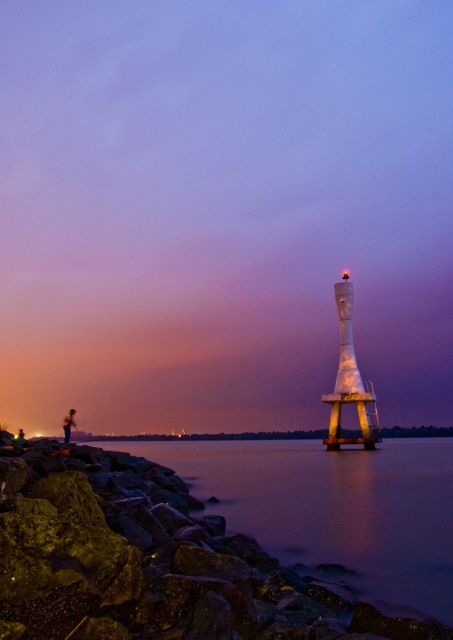
You are a photographer positioned at the metallic figure at lower left. You want to take a photo of the white glossy tower at center. Which direction should you move to frame it properly?

To frame the white glossy tower at center properly, you should move to the right since the white glossy tower at center is located to the right of the metallic figure at lower left.